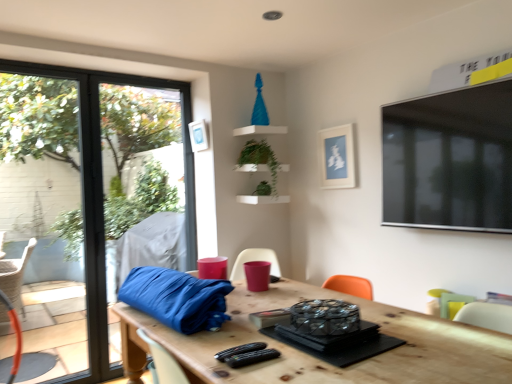
The height and width of the screenshot is (384, 512). Identify the location of white matte picture frame at upper center, the second picture frame in the left-to-right sequence. (337, 157).

The image size is (512, 384). What do you see at coordinates (254, 260) in the screenshot?
I see `matte pink cup at center, the 1th armchair in the left-to-right sequence` at bounding box center [254, 260].

Locate an element on the screen. The height and width of the screenshot is (384, 512). green matte plant at upper center, which appears as the 2th plant when ordered from the bottom is located at coordinates (260, 158).

Where is `green leafy plant at upper center, positioned as the second plant in top-to-bottom order`? The height and width of the screenshot is (384, 512). green leafy plant at upper center, positioned as the second plant in top-to-bottom order is located at coordinates (263, 189).

From the picture: From the image's perspective, does matte pink cup at center, the 1th armchair in the left-to-right sequence, appear lower than green matte plant at upper center, marked as the first plant in a top-to-bottom arrangement?

Indeed, from the image's perspective, matte pink cup at center, the 1th armchair in the left-to-right sequence, is shown beneath green matte plant at upper center, marked as the first plant in a top-to-bottom arrangement.

Does matte pink cup at center, which is the 2th armchair from right to left, have a lesser height compared to green matte plant at upper center, which appears as the 2th plant when ordered from the bottom?

Indeed, matte pink cup at center, which is the 2th armchair from right to left, has a lesser height compared to green matte plant at upper center, which appears as the 2th plant when ordered from the bottom.

Which is closer to the camera, (268, 257) or (260, 151)?

Positioned in front is point (260, 151).

Which is more to the right, matte pink cup at center, which is the 2th armchair from right to left, or green matte plant at upper center, which appears as the 2th plant when ordered from the bottom?

green matte plant at upper center, which appears as the 2th plant when ordered from the bottom.

From a real-world perspective, between wooden table at center and transparent glass window at left, who is vertically lower?

wooden table at center is physically lower.

Does wooden table at center have a greater width compared to transparent glass window at left?

Correct, the width of wooden table at center exceeds that of transparent glass window at left.

Are wooden table at center and transparent glass window at left far apart?

Yes, wooden table at center is far from transparent glass window at left.

Identify the location of window above the wooden table at center (from the image's perspective). This screenshot has height=384, width=512. (83, 199).

From the image's perspective, is green leafy plant at upper center, positioned as the second plant in top-to-bottom order, above or below matte pink cup at center, the 1th armchair in the left-to-right sequence?

Clearly, from the image's perspective, green leafy plant at upper center, positioned as the second plant in top-to-bottom order, is above matte pink cup at center, the 1th armchair in the left-to-right sequence.

Considering the sizes of green leafy plant at upper center, positioned as the second plant in top-to-bottom order, and matte pink cup at center, which is the 2th armchair from right to left, in the image, is green leafy plant at upper center, positioned as the second plant in top-to-bottom order, wider or thinner than matte pink cup at center, which is the 2th armchair from right to left,?

Considering their sizes, green leafy plant at upper center, positioned as the second plant in top-to-bottom order, looks slimmer than matte pink cup at center, which is the 2th armchair from right to left.

Considering the relative positions of green leafy plant at upper center, which is the 1th plant in bottom-to-top order, and matte pink cup at center, positioned as the 2th armchair in bottom-to-top order, in the image provided, is green leafy plant at upper center, which is the 1th plant in bottom-to-top order, to the left or to the right of matte pink cup at center, positioned as the 2th armchair in bottom-to-top order,?

In the image, green leafy plant at upper center, which is the 1th plant in bottom-to-top order, appears on the right side of matte pink cup at center, positioned as the 2th armchair in bottom-to-top order.

Does green leafy plant at upper center, which is the 1th plant in bottom-to-top order, have a lesser height compared to matte pink cup at center, which is the 1th armchair in top-to-bottom order?

Yes.

Is matte pink cup at center, which is the 2th armchair from right to left, oriented towards white matte picture frame at upper center, arranged as the 1th picture frame when viewed from the right?

No.

Does matte pink cup at center, positioned as the 2th armchair in bottom-to-top order, have a lesser width compared to white matte picture frame at upper center, arranged as the 1th picture frame when viewed from the right?

No, matte pink cup at center, positioned as the 2th armchair in bottom-to-top order, is not thinner than white matte picture frame at upper center, arranged as the 1th picture frame when viewed from the right.

How much distance is there between matte pink cup at center, which is the 2th armchair from right to left, and white matte picture frame at upper center, the second picture frame in the left-to-right sequence?

matte pink cup at center, which is the 2th armchair from right to left, is 33.36 inches from white matte picture frame at upper center, the second picture frame in the left-to-right sequence.

From the picture: Is there a large distance between matte pink cup at center, positioned as the 2th armchair in bottom-to-top order, and white matte picture frame at upper center, arranged as the 1th picture frame when viewed from the right?

matte pink cup at center, positioned as the 2th armchair in bottom-to-top order, is actually quite close to white matte picture frame at upper center, arranged as the 1th picture frame when viewed from the right.

From the image's perspective, between transparent glass window at left and green matte plant at upper center, which appears as the 2th plant when ordered from the bottom, which one is located above?

From the image's view, green matte plant at upper center, which appears as the 2th plant when ordered from the bottom, is above.

Considering the positions of objects transparent glass window at left and green matte plant at upper center, which appears as the 2th plant when ordered from the bottom, in the image provided, who is more to the left, transparent glass window at left or green matte plant at upper center, which appears as the 2th plant when ordered from the bottom,?

transparent glass window at left is more to the left.

Considering the positions of objects transparent glass window at left and green matte plant at upper center, which appears as the 2th plant when ordered from the bottom, in the image provided, who is behind, transparent glass window at left or green matte plant at upper center, which appears as the 2th plant when ordered from the bottom,?

green matte plant at upper center, which appears as the 2th plant when ordered from the bottom, is further from the camera.

Based on the photo, from a real-world perspective, who is located lower, wooden table at center or white matte picture frame at upper center, positioned as the second picture frame in right-to-left order?

In real-world perspective, wooden table at center is lower.

Find the location of a particular element. This screenshot has width=512, height=384. table directly beneath the white matte picture frame at upper center, marked as the first picture frame in a left-to-right arrangement (from a real-world perspective) is located at coordinates (319, 360).

Are wooden table at center and white matte picture frame at upper center, marked as the first picture frame in a left-to-right arrangement, far apart?

Yes, wooden table at center and white matte picture frame at upper center, marked as the first picture frame in a left-to-right arrangement, are located far from each other.

Based on the photo, which object is positioned more to the left, wooden table at center or white matte picture frame at upper center, marked as the first picture frame in a left-to-right arrangement?

From the viewer's perspective, white matte picture frame at upper center, marked as the first picture frame in a left-to-right arrangement, appears more on the left side.

From the image's perspective, is white matte picture frame at upper center, the second picture frame in the left-to-right sequence, below transparent glass window at left?

Actually, white matte picture frame at upper center, the second picture frame in the left-to-right sequence, appears above transparent glass window at left in the image.

Is white matte picture frame at upper center, arranged as the 1th picture frame when viewed from the right, further to camera compared to transparent glass window at left?

Yes, white matte picture frame at upper center, arranged as the 1th picture frame when viewed from the right, is further from the viewer.

From a real-world perspective, is white matte picture frame at upper center, arranged as the 1th picture frame when viewed from the right, located higher than transparent glass window at left?

Correct, in the physical world, white matte picture frame at upper center, arranged as the 1th picture frame when viewed from the right, is higher than transparent glass window at left.

The image size is (512, 384). I want to click on the 2nd picture frame to the right of the transparent glass window at left, starting your count from the anchor, so click(337, 157).

This screenshot has width=512, height=384. I want to click on the 1st armchair below the green matte plant at upper center, marked as the first plant in a top-to-bottom arrangement (from the image's perspective), so click(x=254, y=260).

The image size is (512, 384). I want to click on table on the right of transparent glass window at left, so click(x=319, y=360).

When comparing their distances from white matte picture frame at upper center, positioned as the second picture frame in right-to-left order, does pastel green fabric armchair at lower right, the 1th armchair ordered from the bottom, or matte pink cup at center, positioned as the 2th armchair in bottom-to-top order, seem closer?

Based on the image, matte pink cup at center, positioned as the 2th armchair in bottom-to-top order, appears to be nearer to white matte picture frame at upper center, positioned as the second picture frame in right-to-left order.

Estimate the real-world distances between objects in this image. Which object is closer to green leafy plant at upper center, which is the 1th plant in bottom-to-top order, transparent glass window at left or pastel green fabric armchair at lower right, which ranks as the second armchair in left-to-right order?

pastel green fabric armchair at lower right, which ranks as the second armchair in left-to-right order, is closer to green leafy plant at upper center, which is the 1th plant in bottom-to-top order.

Looking at the image, which one is located further to white matte picture frame at upper center, positioned as the second picture frame in right-to-left order, matte pink cup at center, which is the 2th armchair from right to left, or wooden table at center?

wooden table at center is further to white matte picture frame at upper center, positioned as the second picture frame in right-to-left order.

From the image, which object appears to be nearer to white matte picture frame at upper center, marked as the first picture frame in a left-to-right arrangement, green matte plant at upper center, marked as the first plant in a top-to-bottom arrangement, or matte pink cup at center, positioned as the 2th armchair in bottom-to-top order?

The object closer to white matte picture frame at upper center, marked as the first picture frame in a left-to-right arrangement, is green matte plant at upper center, marked as the first plant in a top-to-bottom arrangement.

Considering their positions, is green matte plant at upper center, marked as the first plant in a top-to-bottom arrangement, positioned closer to wooden table at center than white matte picture frame at upper center, positioned as the second picture frame in right-to-left order?

green matte plant at upper center, marked as the first plant in a top-to-bottom arrangement, is positioned closer to the anchor wooden table at center.

Considering their positions, is wooden table at center positioned closer to transparent glass window at left than pastel green fabric armchair at lower right, the 1th armchair when ordered from right to left?

The object closer to transparent glass window at left is wooden table at center.

Looking at the image, which one is located closer to white matte picture frame at upper center, marked as the first picture frame in a left-to-right arrangement, green leafy plant at upper center, which is the 1th plant in bottom-to-top order, or matte pink cup at center, positioned as the 2th armchair in bottom-to-top order?

green leafy plant at upper center, which is the 1th plant in bottom-to-top order, is closer to white matte picture frame at upper center, marked as the first picture frame in a left-to-right arrangement.

Which object lies nearer to the anchor point wooden table at center, matte pink cup at center, which is the 2th armchair from right to left, or transparent glass window at left?

matte pink cup at center, which is the 2th armchair from right to left.

Find the location of a particular element. picture frame between wooden table at center and white matte picture frame at upper center, marked as the first picture frame in a left-to-right arrangement, along the z-axis is located at coordinates (337, 157).

The width and height of the screenshot is (512, 384). Identify the location of armchair positioned between matte pink cup at center, which is the 2th armchair from right to left, and green leafy plant at upper center, positioned as the second plant in top-to-bottom order, from near to far. (453, 304).

Identify the location of armchair situated between transparent glass window at left and pastel green fabric armchair at lower right, which ranks as the second armchair in left-to-right order, from left to right. The height and width of the screenshot is (384, 512). (254, 260).

Identify the location of plant between matte pink cup at center, which is the 1th armchair in top-to-bottom order, and white matte picture frame at upper center, marked as the first picture frame in a left-to-right arrangement, from front to back. (260, 158).